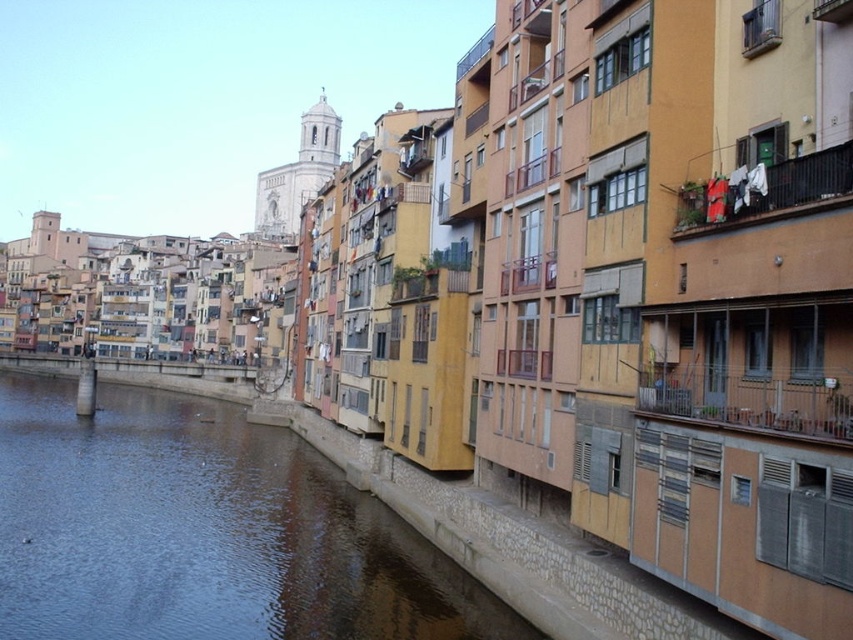
Between blue water at lower left and white fabric at upper right, which one is positioned higher?

white fabric at upper right

Which is more to the right, blue water at lower left or white fabric at upper right?

white fabric at upper right

What do you see at coordinates (204, 531) in the screenshot? Image resolution: width=853 pixels, height=640 pixels. I see `blue water at lower left` at bounding box center [204, 531].

In order to click on blue water at lower left in this screenshot , I will do `click(204, 531)`.